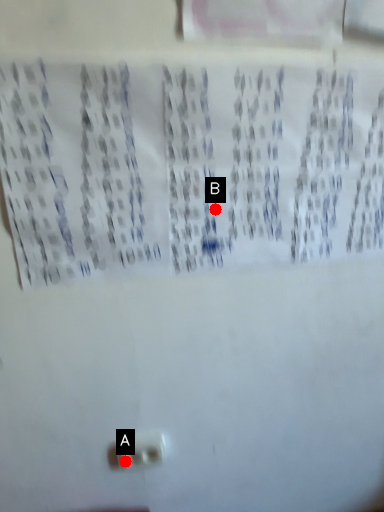
Question: Two points are circled on the image, labeled by A and B beside each circle. Which point appears closest to the camera in this image?

Choices:
 (A) A is closer
 (B) B is closer

Answer: (B)